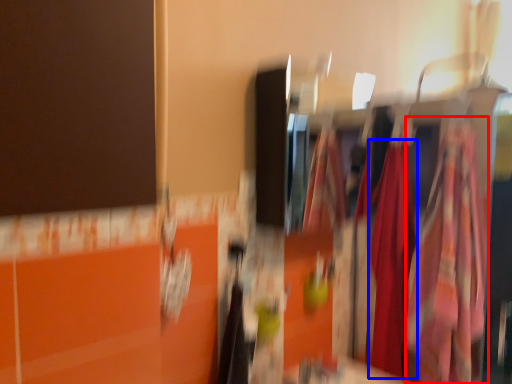
Question: Which point is closer to the camera, clothing (highlighted by a red box) or clothing (highlighted by a blue box)?

Choices:
 (A) clothing
 (B) clothing

Answer: (A)